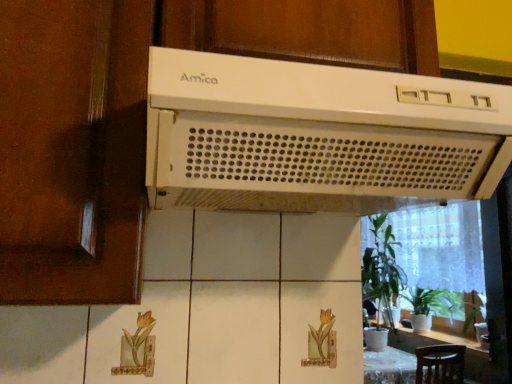
Question: Can white plastic range hood at upper center be found inside green leafy plant at right, acting as the 2th houseplant starting from the right?

Choices:
 (A) no
 (B) yes

Answer: (A)

Question: Can you confirm if green leafy plant at right, acting as the 2th houseplant starting from the right, is smaller than white plastic range hood at upper center?

Choices:
 (A) no
 (B) yes

Answer: (A)

Question: Can you confirm if green leafy plant at right, arranged as the 1th houseplant when viewed from the left, is shorter than white plastic range hood at upper center?

Choices:
 (A) yes
 (B) no

Answer: (B)

Question: From the image's perspective, is green leafy plant at right, arranged as the 1th houseplant when viewed from the left, over white plastic range hood at upper center?

Choices:
 (A) yes
 (B) no

Answer: (B)

Question: Is green leafy plant at right, arranged as the 1th houseplant when viewed from the left, outside of white plastic range hood at upper center?

Choices:
 (A) no
 (B) yes

Answer: (B)

Question: Are green leafy plant at right, acting as the 2th houseplant starting from the right, and white plastic range hood at upper center located far from each other?

Choices:
 (A) no
 (B) yes

Answer: (B)

Question: From a real-world perspective, is green leafy plant at right, arranged as the 1th houseplant when viewed from the left, beneath matte brown screen door at left?

Choices:
 (A) yes
 (B) no

Answer: (A)

Question: Can you confirm if green leafy plant at right, acting as the 2th houseplant starting from the right, is taller than matte brown screen door at left?

Choices:
 (A) no
 (B) yes

Answer: (B)

Question: Would you consider green leafy plant at right, acting as the 2th houseplant starting from the right, to be distant from matte brown screen door at left?

Choices:
 (A) yes
 (B) no

Answer: (A)

Question: Does green leafy plant at right, arranged as the 1th houseplant when viewed from the left, have a larger size compared to matte brown screen door at left?

Choices:
 (A) yes
 (B) no

Answer: (A)

Question: Is green leafy plant at right, acting as the 2th houseplant starting from the right, to the left of matte brown screen door at left from the viewer's perspective?

Choices:
 (A) no
 (B) yes

Answer: (A)

Question: From the image's perspective, is green leafy plant at right, acting as the 2th houseplant starting from the right, beneath matte brown screen door at left?

Choices:
 (A) no
 (B) yes

Answer: (B)

Question: Is green glossy houseplant at lower right, which is the 1th houseplant in right-to-left order, outside of matte brown screen door at left?

Choices:
 (A) no
 (B) yes

Answer: (B)